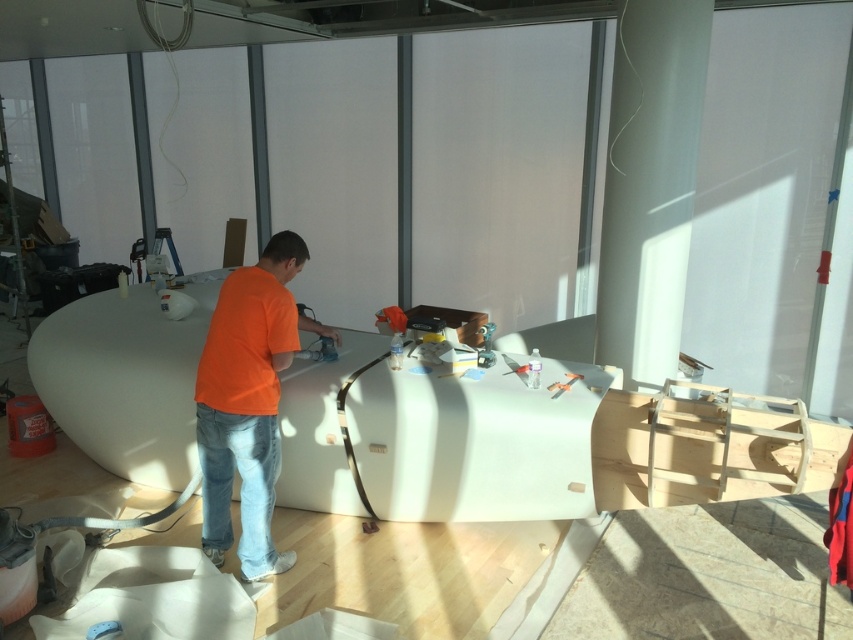
You are a safety inspector checking the workspace. You notice the orange cotton shirt at center and the denim at center. According to safety protocols, all clothing must be kept at least 1 meter away from power tools. Are both items compliant with this rule?

The orange cotton shirt at center is to the right of denim at center, but the distance between them isn not specified. Safety protocols require all clothing to be at least 1 meter away from power tools. Without knowing the exact distance, it cannot be confirmed if they comply.

You are a worker in the workshop and need to reach both the point at (262, 440) and the point at (218, 552). Which point should you approach first if you want to reach the one closer to your current position?

You should approach the point at (262, 440) first because it is closer to your current position compared to the point at (218, 552).